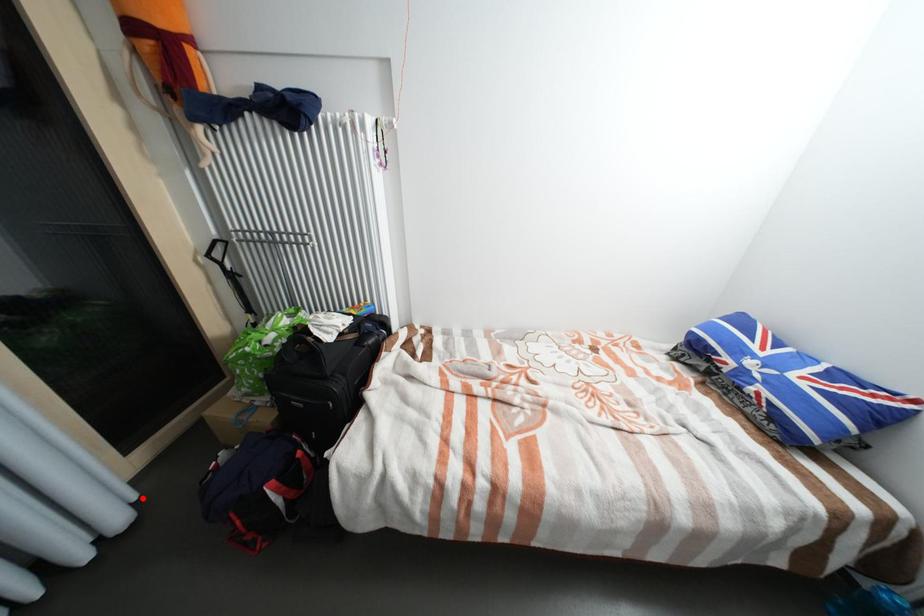
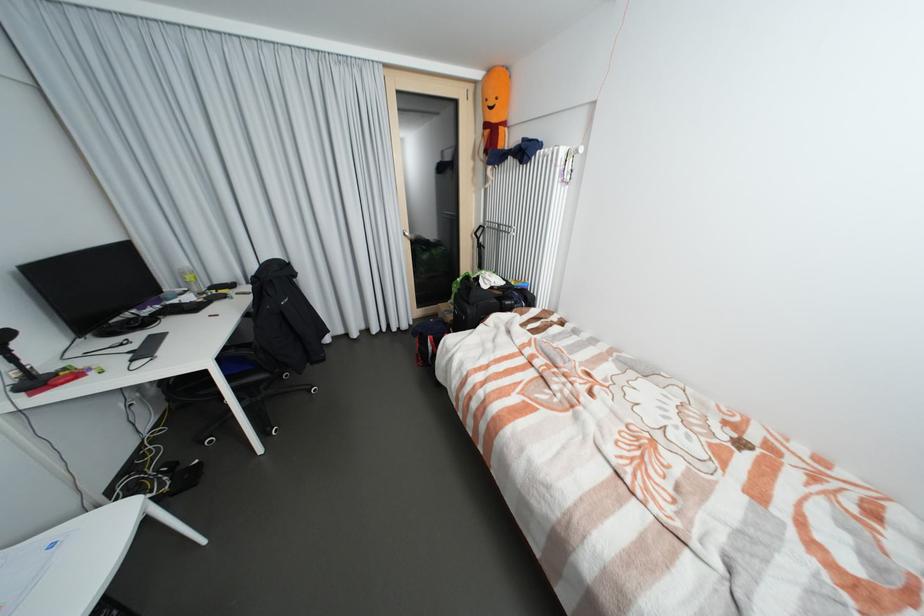
Question: I am providing you with two images of the same scene from different viewpoints. A red point is marked on the first image. Is the red point's position out of view in image 2?

Choices:
 (A) Yes
 (B) No

Answer: (B)